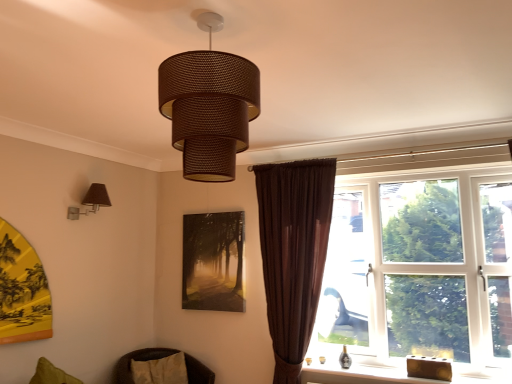
This screenshot has height=384, width=512. Describe the element at coordinates (91, 201) in the screenshot. I see `matte brown lampshade at left, which is the first lamp in left-to-right order` at that location.

What do you see at coordinates (138, 360) in the screenshot?
I see `brown woven cushion at lower left` at bounding box center [138, 360].

Measure the distance between brown woven lampshade at center, which is the first lamp in front-to-back order, and camera.

brown woven lampshade at center, which is the first lamp in front-to-back order, is 3.95 feet from camera.

You are a GUI agent. You are given a task and a screenshot of the screen. Output one action in this format:
    pyautogui.click(x=<x>, y=<y>)
    Task: Click on the brown velvet curtain at right
    The image size is (512, 384).
    Given the screenshot: What is the action you would take?
    pyautogui.click(x=293, y=253)

Find the location of `matte brown lampshade at left, positioned as the 1th lamp in back-to-front order`. matte brown lampshade at left, positioned as the 1th lamp in back-to-front order is located at coordinates (91, 201).

Based on the photo, considering the positions of objects brown woven lampshade at center, which is the first lamp in front-to-back order, and velvet beige pillow at lower left in the image provided, who is more to the right, brown woven lampshade at center, which is the first lamp in front-to-back order, or velvet beige pillow at lower left?

From the viewer's perspective, brown woven lampshade at center, which is the first lamp in front-to-back order, appears more on the right side.

From the image's perspective, relative to velvet beige pillow at lower left, is brown woven lampshade at center, which is counted as the 2th lamp, starting from the left, above or below?

Based on their image positions, brown woven lampshade at center, which is counted as the 2th lamp, starting from the left, is located above velvet beige pillow at lower left.

Does brown woven lampshade at center, the first lamp when ordered from right to left, lie behind velvet beige pillow at lower left?

That is False.

At what (x,y) coordinates should I click in order to perform the action: click on pillow lying on the left of brown woven lampshade at center, the second lamp from the bottom. Please return your answer as a coordinate pair (x, y). The height and width of the screenshot is (384, 512). Looking at the image, I should click on (160, 370).

In terms of size, does matte brown lampshade at left, the second lamp in the front-to-back sequence, appear bigger or smaller than brown velvet curtain at right?

Clearly, matte brown lampshade at left, the second lamp in the front-to-back sequence, is smaller in size than brown velvet curtain at right.

Between matte brown lampshade at left, positioned as the 1th lamp in back-to-front order, and brown velvet curtain at right, which one has more height?

brown velvet curtain at right is taller.

From the image's perspective, is matte brown lampshade at left, the second lamp in the front-to-back sequence, located beneath brown velvet curtain at right?

No, from the image's perspective, matte brown lampshade at left, the second lamp in the front-to-back sequence, is not beneath brown velvet curtain at right.

Is there a large distance between matte brown lampshade at left, positioned as the 1th lamp in back-to-front order, and brown velvet curtain at right?

Yes.

In the image, is matte brown curtain at right on the left side or the right side of matte black painting at center?

Clearly, matte brown curtain at right is on the right of matte black painting at center in the image.

Is matte brown curtain at right wider than matte black painting at center?

Yes, matte brown curtain at right is wider than matte black painting at center.

Which is further, [467,248] or [231,241]?

The point [231,241] is farther.

Between matte brown curtain at right and matte black painting at center, which one is positioned in front?

matte brown curtain at right is more forward.

Considering the sizes of objects velvet beige pillow at lower left and brown velvet curtain at right in the image provided, who is shorter, velvet beige pillow at lower left or brown velvet curtain at right?

velvet beige pillow at lower left is shorter.

Is velvet beige pillow at lower left situated inside brown velvet curtain at right or outside?

velvet beige pillow at lower left exists outside the volume of brown velvet curtain at right.

Who is smaller, velvet beige pillow at lower left or brown velvet curtain at right?

velvet beige pillow at lower left is smaller.

Locate an element on the screen. pillow behind the brown velvet curtain at right is located at coordinates (160, 370).

Based on the photo, from the image's perspective, relative to matte brown curtain at right, is matte brown lampshade at left, which is the first lamp in left-to-right order, above or below?

From the image's perspective, matte brown lampshade at left, which is the first lamp in left-to-right order, appears above matte brown curtain at right.

In the scene shown: Is matte brown lampshade at left, which ranks as the second lamp in right-to-left order, facing towards matte brown curtain at right?

No, matte brown lampshade at left, which ranks as the second lamp in right-to-left order, is not facing towards matte brown curtain at right.

Which is more to the left, matte brown lampshade at left, which ranks as the second lamp in right-to-left order, or matte brown curtain at right?

From the viewer's perspective, matte brown lampshade at left, which ranks as the second lamp in right-to-left order, appears more on the left side.

Is brown woven lampshade at center, which ranks as the second lamp in back-to-front order, next to brown woven cushion at lower left and touching it?

No, brown woven lampshade at center, which ranks as the second lamp in back-to-front order, is not touching brown woven cushion at lower left.

Can you tell me how much brown woven lampshade at center, the first lamp when ordered from right to left, and brown woven cushion at lower left differ in facing direction?

64.1 degrees.

This screenshot has width=512, height=384. Find the location of `furniture located on the left of brown woven lampshade at center, the first lamp when ordered from right to left`. furniture located on the left of brown woven lampshade at center, the first lamp when ordered from right to left is located at coordinates (138, 360).

From a real-world perspective, is brown woven lampshade at center, placed as the first lamp when sorted from top to bottom, positioned above or below brown woven cushion at lower left?

In terms of real-world spatial position, brown woven lampshade at center, placed as the first lamp when sorted from top to bottom, is above brown woven cushion at lower left.

Considering the relative sizes of brown woven cushion at lower left and brown velvet curtain at right in the image provided, is brown woven cushion at lower left bigger than brown velvet curtain at right?

Incorrect, brown woven cushion at lower left is not larger than brown velvet curtain at right.

Image resolution: width=512 pixels, height=384 pixels. Identify the location of curtain that is in front of the brown woven cushion at lower left. (293, 253).

Could you tell me if brown woven cushion at lower left is turned towards brown velvet curtain at right?

No, brown woven cushion at lower left does not turn towards brown velvet curtain at right.

Is point (188, 359) more distant than point (308, 322)?

Yes, it is.

Locate an element on the screen. The width and height of the screenshot is (512, 384). pillow that appears behind the brown woven lampshade at center, which ranks as the second lamp in back-to-front order is located at coordinates (160, 370).

Image resolution: width=512 pixels, height=384 pixels. Identify the location of curtain that is on the right side of matte brown lampshade at left, positioned as the 1th lamp in back-to-front order. (293, 253).

From the image, which object appears to be nearer to brown woven lampshade at center, the second lamp from the bottom, velvet beige pillow at lower left or wooden block at lower right?

The object closer to brown woven lampshade at center, the second lamp from the bottom, is wooden block at lower right.

Considering their positions, is brown velvet curtain at right positioned closer to velvet beige pillow at lower left than brown woven lampshade at center, the second lamp from the bottom?

The object closer to velvet beige pillow at lower left is brown velvet curtain at right.

Estimate the real-world distances between objects in this image. Which object is closer to brown velvet curtain at right, matte black painting at center or matte brown lampshade at left, which is the first lamp in left-to-right order?

The object closer to brown velvet curtain at right is matte black painting at center.

Considering their positions, is brown woven cushion at lower left positioned further to brown woven lampshade at center, the first lamp when ordered from right to left, than velvet beige pillow at lower left?

The object further to brown woven lampshade at center, the first lamp when ordered from right to left, is brown woven cushion at lower left.

From the image, which object appears to be nearer to velvet beige pillow at lower left, matte black painting at center or wooden block at lower right?

Based on the image, matte black painting at center appears to be nearer to velvet beige pillow at lower left.

Estimate the real-world distances between objects in this image. Which object is closer to velvet beige pillow at lower left, brown woven cushion at lower left or brown woven lampshade at center, placed as the first lamp when sorted from top to bottom?

The object closer to velvet beige pillow at lower left is brown woven cushion at lower left.

Which object lies nearer to the anchor point brown woven lampshade at center, the first lamp when ordered from right to left, brown velvet curtain at right or wooden block at lower right?

brown velvet curtain at right.

Which object lies nearer to the anchor point wooden block at lower right, brown woven cushion at lower left or brown woven lampshade at center, the second lamp from the bottom?

The object closer to wooden block at lower right is brown woven cushion at lower left.

The height and width of the screenshot is (384, 512). In order to click on curtain between matte black painting at center and wooden block at lower right in the horizontal direction in this screenshot , I will do `click(293, 253)`.

I want to click on curtain between velvet beige pillow at lower left and wooden block at lower right from left to right, so click(293, 253).

At what (x,y) coordinates should I click in order to perform the action: click on furniture between matte brown lampshade at left, marked as the 2th lamp in a top-to-bottom arrangement, and matte brown curtain at right from left to right. Please return your answer as a coordinate pair (x, y). Looking at the image, I should click on (138, 360).

Locate an element on the screen. The width and height of the screenshot is (512, 384). furniture between brown woven lampshade at center, which is the first lamp in front-to-back order, and matte black painting at center in the front-back direction is located at coordinates (138, 360).